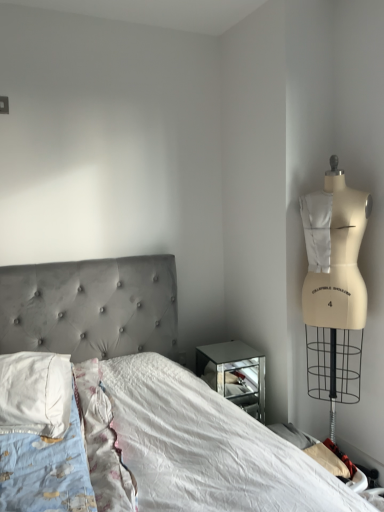
What do you see at coordinates (159, 390) in the screenshot?
I see `velvet grey bed at center` at bounding box center [159, 390].

Where is `velvet grey bed at center`? The height and width of the screenshot is (512, 384). velvet grey bed at center is located at coordinates (159, 390).

In order to face white soft pillow at left, should I rotate leftwards or rightwards?

You should look left and rotate roughly 20.576 degrees.

What is the approximate width of white soft pillow at left?

22.63 inches.

Locate an element on the screen. The height and width of the screenshot is (512, 384). white soft pillow at left is located at coordinates (35, 393).

The width and height of the screenshot is (384, 512). Describe the element at coordinates (35, 393) in the screenshot. I see `white soft pillow at left` at that location.

Where is `velvet grey bed at center`? The image size is (384, 512). velvet grey bed at center is located at coordinates (159, 390).

Which is more to the left, velvet grey bed at center or white soft pillow at left?

From the viewer's perspective, white soft pillow at left appears more on the left side.

Is velvet grey bed at center in front of white soft pillow at left?

Yes, velvet grey bed at center is in front of white soft pillow at left.

Which is further, (155, 504) or (1, 366)?

Positioned behind is point (1, 366).

From the image's perspective, which object appears higher, velvet grey bed at center or white soft pillow at left?

white soft pillow at left is shown above in the image.

From a real-world perspective, which is physically above, velvet grey bed at center or white soft pillow at left?

white soft pillow at left is physically above.

Considering the relative sizes of velvet grey bed at center and white soft pillow at left in the image provided, is velvet grey bed at center wider than white soft pillow at left?

Indeed, velvet grey bed at center has a greater width compared to white soft pillow at left.

Considering the relative sizes of velvet grey bed at center and white soft pillow at left in the image provided, is velvet grey bed at center taller than white soft pillow at left?

Yes, velvet grey bed at center is taller than white soft pillow at left.

Which of these two, velvet grey bed at center or white soft pillow at left, is smaller?

Smaller between the two is white soft pillow at left.

Consider the image. Is velvet grey bed at center not within white soft pillow at left?

velvet grey bed at center lies outside white soft pillow at left's area.

Does velvet grey bed at center touch white soft pillow at left?

No, velvet grey bed at center is not with white soft pillow at left.

Is velvet grey bed at center aimed at white soft pillow at left?

No, velvet grey bed at center is not facing towards white soft pillow at left.

The height and width of the screenshot is (512, 384). Find the location of `pillow located on the left of velvet grey bed at center`. pillow located on the left of velvet grey bed at center is located at coordinates (35, 393).

Can you confirm if white soft pillow at left is positioned to the right of velvet grey bed at center?

No.

Is white soft pillow at left positioned before velvet grey bed at center?

No, it is behind velvet grey bed at center.

Is point (58, 433) behind point (137, 380)?

No, it is not.

From the image's perspective, which one is positioned lower, white soft pillow at left or velvet grey bed at center?

velvet grey bed at center appears lower in the image.

From a real-world perspective, which is physically below, white soft pillow at left or velvet grey bed at center?

In real-world perspective, velvet grey bed at center is lower.

Between white soft pillow at left and velvet grey bed at center, which one has smaller width?

Thinner between the two is white soft pillow at left.

Is white soft pillow at left taller or shorter than velvet grey bed at center?

Considering their sizes, white soft pillow at left has less height than velvet grey bed at center.

Who is bigger, white soft pillow at left or velvet grey bed at center?

velvet grey bed at center is bigger.

Is white soft pillow at left inside the boundaries of velvet grey bed at center, or outside?

white soft pillow at left lies within the bounds of velvet grey bed at center.

Is white soft pillow at left far from velvet grey bed at center?

No, white soft pillow at left is not far from velvet grey bed at center.

Is white soft pillow at left oriented away from velvet grey bed at center?

Correct, white soft pillow at left is looking away from velvet grey bed at center.

What's the angular difference between white soft pillow at left and velvet grey bed at center's facing directions?

The angular difference between white soft pillow at left and velvet grey bed at center is 0.42 degrees.

Measure the distance between white soft pillow at left and velvet grey bed at center.

white soft pillow at left is 14.38 inches away from velvet grey bed at center.

Find the location of `bed in front of the white soft pillow at left`. bed in front of the white soft pillow at left is located at coordinates coord(159,390).

In order to click on bed in front of the white soft pillow at left in this screenshot , I will do `click(159, 390)`.

The image size is (384, 512). I want to click on pillow above the velvet grey bed at center (from the image's perspective), so click(x=35, y=393).